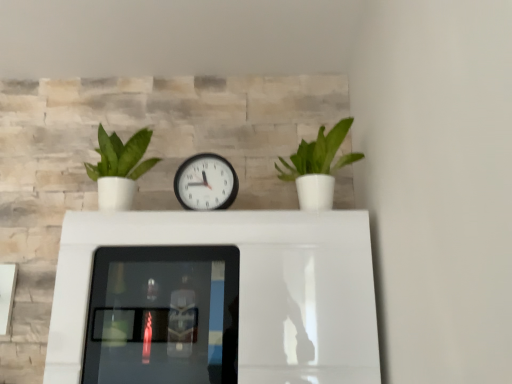
Question: Is green matte plant at right, the second houseplant when ordered from left to right, smaller than white glossy table at center?

Choices:
 (A) no
 (B) yes

Answer: (B)

Question: Is green matte plant at right, which appears as the 1th houseplant when viewed from the right, to the left of white glossy table at center from the viewer's perspective?

Choices:
 (A) yes
 (B) no

Answer: (B)

Question: Does green matte plant at right, which appears as the 1th houseplant when viewed from the right, have a greater height compared to white glossy table at center?

Choices:
 (A) yes
 (B) no

Answer: (B)

Question: Is white glossy table at center located within green matte plant at right, the second houseplant when ordered from left to right?

Choices:
 (A) yes
 (B) no

Answer: (B)

Question: Could you tell me if green matte plant at right, which appears as the 1th houseplant when viewed from the right, is facing white glossy table at center?

Choices:
 (A) yes
 (B) no

Answer: (B)

Question: Do you think white glossy table at center is within green matte plant at right, which appears as the 1th houseplant when viewed from the right, or outside of it?

Choices:
 (A) outside
 (B) inside

Answer: (A)

Question: Is point (219, 243) closer or farther from the camera than point (300, 201)?

Choices:
 (A) closer
 (B) farther

Answer: (A)

Question: Considering the relative positions of white glossy table at center and green matte plant at right, which appears as the 1th houseplant when viewed from the right, in the image provided, is white glossy table at center to the left or to the right of green matte plant at right, which appears as the 1th houseplant when viewed from the right,?

Choices:
 (A) left
 (B) right

Answer: (A)

Question: From a real-world perspective, is white glossy table at center positioned above or below green matte plant at right, the second houseplant when ordered from left to right?

Choices:
 (A) above
 (B) below

Answer: (B)

Question: Does point (208, 190) appear closer or farther from the camera than point (340, 132)?

Choices:
 (A) farther
 (B) closer

Answer: (A)

Question: Is white plastic wall clock at center taller or shorter than green matte plant at right, which appears as the 1th houseplant when viewed from the right?

Choices:
 (A) short
 (B) tall

Answer: (A)

Question: From a real-world perspective, relative to green matte plant at right, which appears as the 1th houseplant when viewed from the right, is white plastic wall clock at center vertically above or below?

Choices:
 (A) below
 (B) above

Answer: (A)

Question: From the image's perspective, relative to green matte plant at right, which appears as the 1th houseplant when viewed from the right, is white plastic wall clock at center above or below?

Choices:
 (A) above
 (B) below

Answer: (B)

Question: Based on their sizes in the image, would you say white glossy table at center is bigger or smaller than green matte plant at left, the second houseplant in the right-to-left sequence?

Choices:
 (A) big
 (B) small

Answer: (A)

Question: Considering their positions, is white glossy table at center located in front of or behind green matte plant at left, the first houseplant from the left?

Choices:
 (A) behind
 (B) front

Answer: (B)